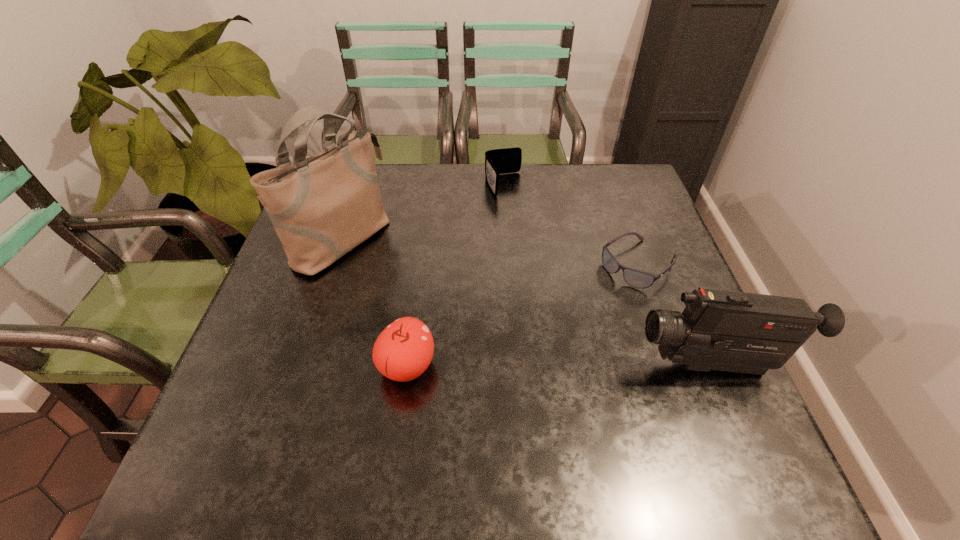
The height and width of the screenshot is (540, 960). Find the location of `free point at the left edge`. free point at the left edge is located at coordinates (308, 303).

In the image, there is a desktop. Where is `free space at the right edge`? The width and height of the screenshot is (960, 540). free space at the right edge is located at coordinates (619, 214).

Where is `free spot between the leftmost object and the sunglasses`? This screenshot has width=960, height=540. free spot between the leftmost object and the sunglasses is located at coordinates pos(490,252).

Find the location of a particular element. vacant area that lies between the sunglasses and the fourth object from right to left is located at coordinates (523, 315).

Identify the location of free space between the tallest object and the fourth object from right to left. This screenshot has width=960, height=540. (374, 302).

You are a GUI agent. You are given a task and a screenshot of the screen. Output one action in this format:
    pyautogui.click(x=<x>, y=<y>)
    Task: Click on the free space that is in between the third tallest object and the fourth shortest object
    The width and height of the screenshot is (960, 540).
    Given the screenshot: What is the action you would take?
    pyautogui.click(x=559, y=366)

At what (x,y) coordinates should I click in order to perform the action: click on free space between the third tallest object and the third object from right to left. Please return your answer as a coordinate pair (x, y). Image resolution: width=960 pixels, height=540 pixels. Looking at the image, I should click on (455, 275).

I want to click on vacant space in between the second tallest object and the farthest object, so click(608, 275).

Where is `free space between the fourth object from right to left and the fourth tallest object`? Image resolution: width=960 pixels, height=540 pixels. free space between the fourth object from right to left and the fourth tallest object is located at coordinates (455, 275).

Locate an element on the screen. free space that is in between the shoulder bag and the apple is located at coordinates (374, 302).